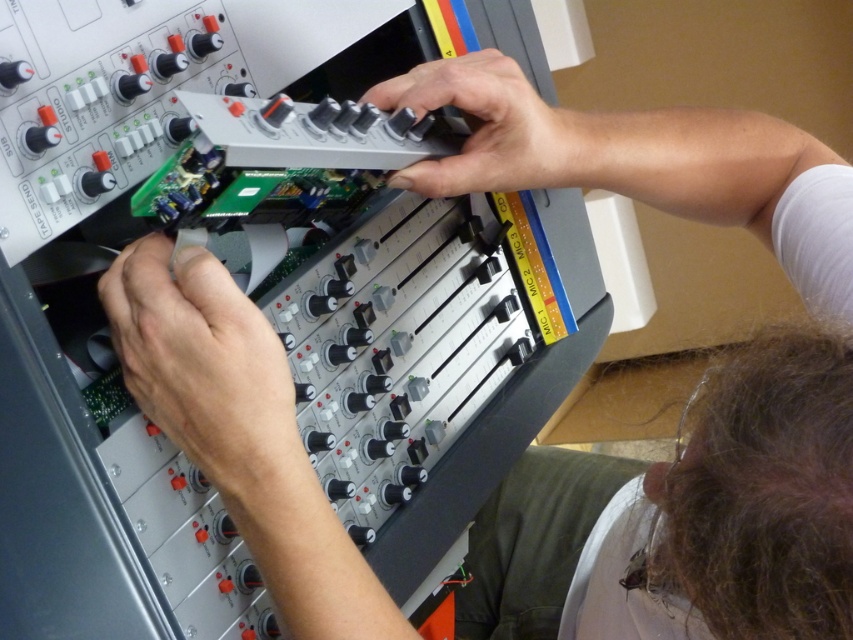
Between matte black circuit board at lower left and metallic gray control panel at center, which one is positioned lower?

matte black circuit board at lower left is below.

The image size is (853, 640). I want to click on matte black circuit board at lower left, so click(x=202, y=364).

Does point (247, 429) come behind point (520, 188)?

That is False.

Locate an element on the screen. The width and height of the screenshot is (853, 640). matte black circuit board at lower left is located at coordinates (x=202, y=364).